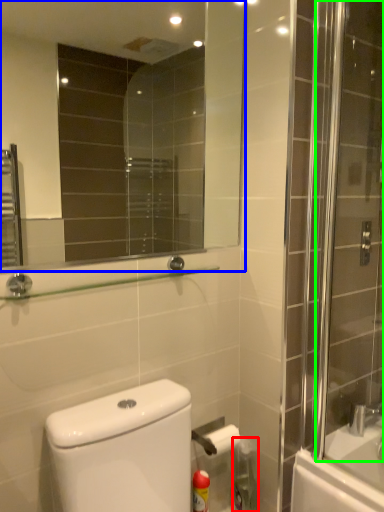
Question: Estimate the real-world distances between objects in this image. Which object is farther from cleaning product (highlighted by a red box), mirror (highlighted by a blue box) or screen door (highlighted by a green box)?

Choices:
 (A) mirror
 (B) screen door

Answer: (A)